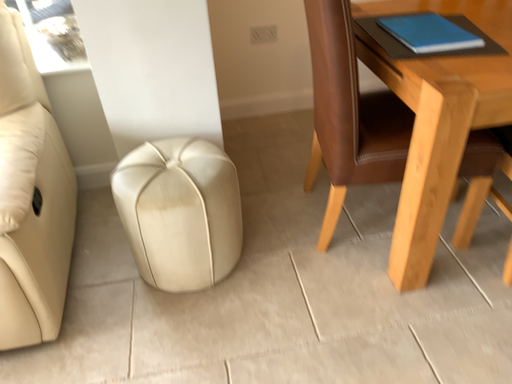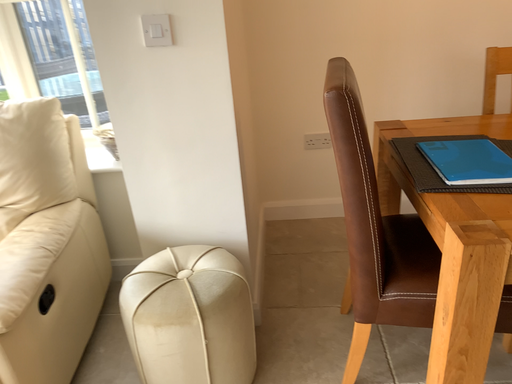
Question: Which way did the camera rotate in the video?

Choices:
 (A) rotated right
 (B) rotated left

Answer: (B)